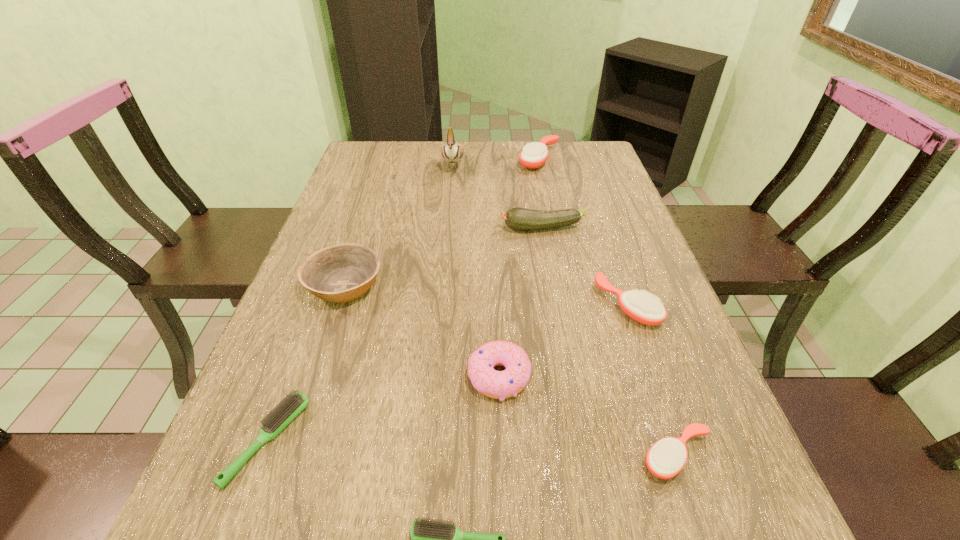
Locate an element on the screen. The width and height of the screenshot is (960, 540). the tallest object is located at coordinates (452, 152).

You are a GUI agent. You are given a task and a screenshot of the screen. Output one action in this format:
    pyautogui.click(x=<x>, y=<y>)
    Task: Click on the farthest hairbrush
    Image resolution: width=960 pixels, height=540 pixels.
    Given the screenshot: What is the action you would take?
    pyautogui.click(x=534, y=155)

The height and width of the screenshot is (540, 960). I want to click on the farthest orange hairbrush, so click(x=534, y=155).

Where is `the seventh nearest object`? This screenshot has width=960, height=540. the seventh nearest object is located at coordinates (523, 219).

Locate an element on the screen. This screenshot has height=540, width=960. zucchini is located at coordinates (523, 219).

Find the location of a particular element. The width and height of the screenshot is (960, 540). bowl is located at coordinates (340, 273).

This screenshot has width=960, height=540. I want to click on pink doughnut, so click(495, 384).

Find the location of `the second farthest orange hairbrush`. the second farthest orange hairbrush is located at coordinates (641, 306).

Find the location of `the second tallest hairbrush`. the second tallest hairbrush is located at coordinates (641, 306).

You are a GUI agent. You are given a task and a screenshot of the screen. Output one action in this format:
    pyautogui.click(x=<x>, y=<y>)
    Task: Click on the smallest orange hairbrush
    Image resolution: width=960 pixels, height=540 pixels.
    Given the screenshot: What is the action you would take?
    pyautogui.click(x=666, y=458)